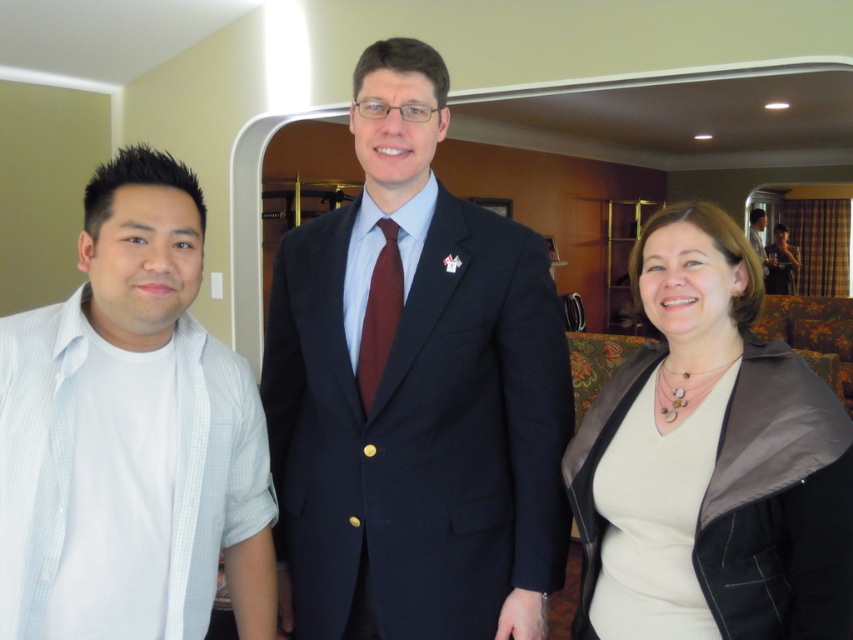
You are a photographer setting up for a group photo in the hotel room. You need to ensure that both the navy blue suit at center and the matte black jacket at lower right are visible in the frame. Based on their positions, which clothing item is higher up in the image?

The navy blue suit at center is located above the matte black jacket at lower right, so it is higher up in the image.

You are a photographer setting up for a group photo. You need to ensure that the white cotton shirt at left and the burgundy silk tie at center are both visible in the frame. Given their sizes, which item might require more adjustment to fit into the camera frame?

The white cotton shirt at left has a larger width than the burgundy silk tie at center, so it might require more adjustment to fit into the camera frame.

You are a photographer setting up for a group photo in a hotel room. You have two subjects wearing the white matte dress at center and the dark blue suit at center. You want to arrange them so that their outfits are clearly visible. Based on their clothing, which subject should you position closer to the camera to avoid overlapping their outfits?

The white matte dress at center is thinner than the dark blue suit at center, so you should position the person wearing the dark blue suit at center closer to the camera to prevent their outfit from overlapping with the thinner white matte dress at center.